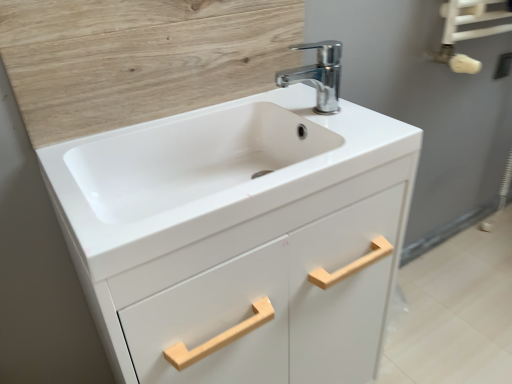
Question: Looking at the image, does wooden panel at upper left seem bigger or smaller compared to white glossy towel rack at upper right?

Choices:
 (A) big
 (B) small

Answer: (B)

Question: From a real-world perspective, relative to white glossy towel rack at upper right, is wooden panel at upper left vertically above or below?

Choices:
 (A) below
 (B) above

Answer: (B)

Question: Which object is the farthest from the chrome metallic faucet at upper center?

Choices:
 (A) white matte cabinet at center
 (B) wooden panel at upper left
 (C) white glossy sink at center
 (D) white glossy towel rack at upper right

Answer: (D)

Question: Estimate the real-world distances between objects in this image. Which object is farther from the white glossy towel rack at upper right?

Choices:
 (A) white glossy sink at center
 (B) chrome metallic faucet at upper center
 (C) white matte cabinet at center
 (D) wooden panel at upper left

Answer: (D)